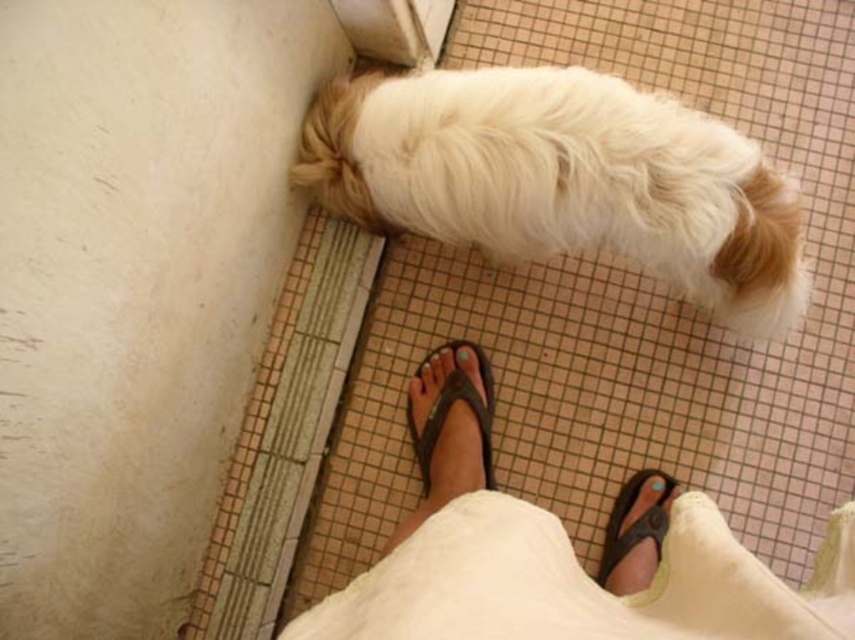
Question: Estimate the real-world distances between objects in this image. Which object is closer to the white fluffy dog at center?

Choices:
 (A) black rubber sandal at lower center
 (B) brown leather flip-flop at lower center

Answer: (B)

Question: Observing the image, what is the correct spatial positioning of white fluffy dog at center in reference to black rubber sandal at lower center?

Choices:
 (A) above
 (B) below

Answer: (A)

Question: Considering the relative positions of white fluffy dog at center and brown leather flip-flop at lower center in the image provided, where is white fluffy dog at center located with respect to brown leather flip-flop at lower center?

Choices:
 (A) right
 (B) left

Answer: (A)

Question: Among these points, which one is farthest from the camera?

Choices:
 (A) (617, 529)
 (B) (458, 372)
 (C) (529, 195)

Answer: (B)

Question: Among these points, which one is farthest from the camera?

Choices:
 (A) (514, 141)
 (B) (431, 428)

Answer: (B)

Question: Does black rubber sandal at lower center appear over brown leather flip-flop at lower center?

Choices:
 (A) yes
 (B) no

Answer: (B)